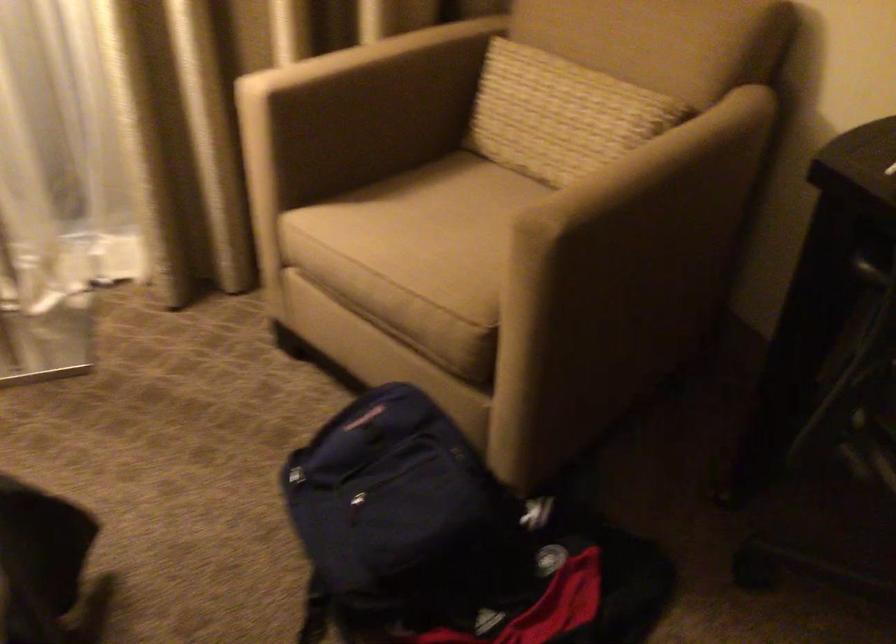
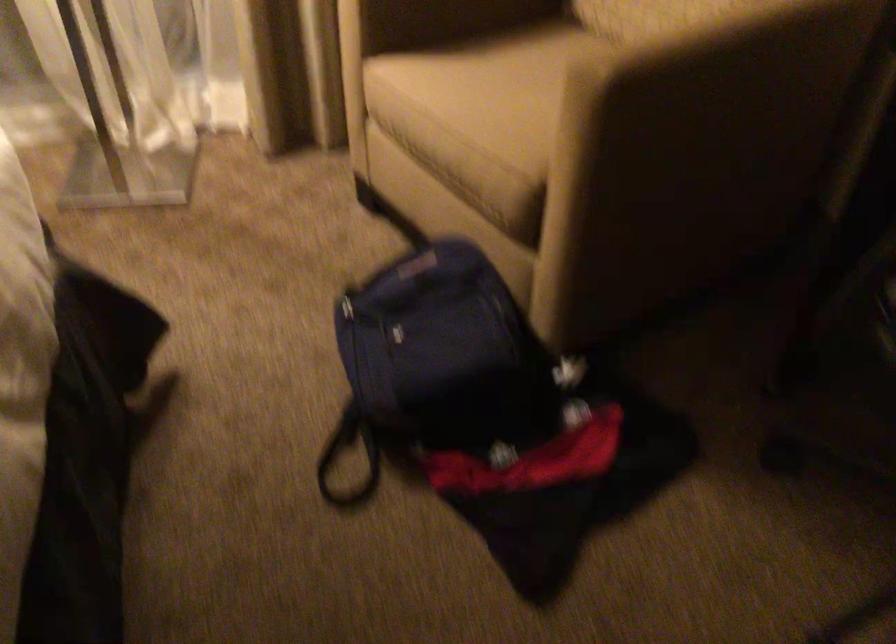
Find the pixel in the second image that matches point (259, 242) in the first image.

(343, 90)